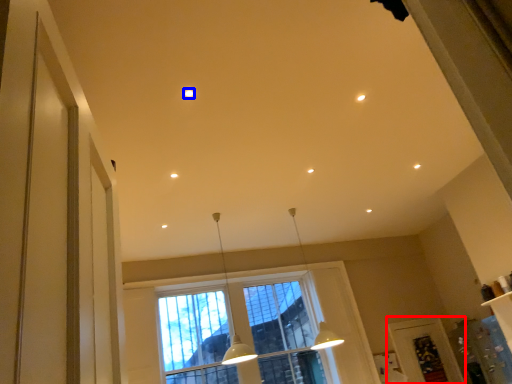
Question: Which object appears farthest to the camera in this image, screen door (highlighted by a red box) or lighting (highlighted by a blue box)?

Choices:
 (A) screen door
 (B) lighting

Answer: (A)